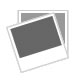
This screenshot has height=80, width=80. Find the location of `polaroid pictures`. polaroid pictures is located at coordinates (50, 59), (64, 19).